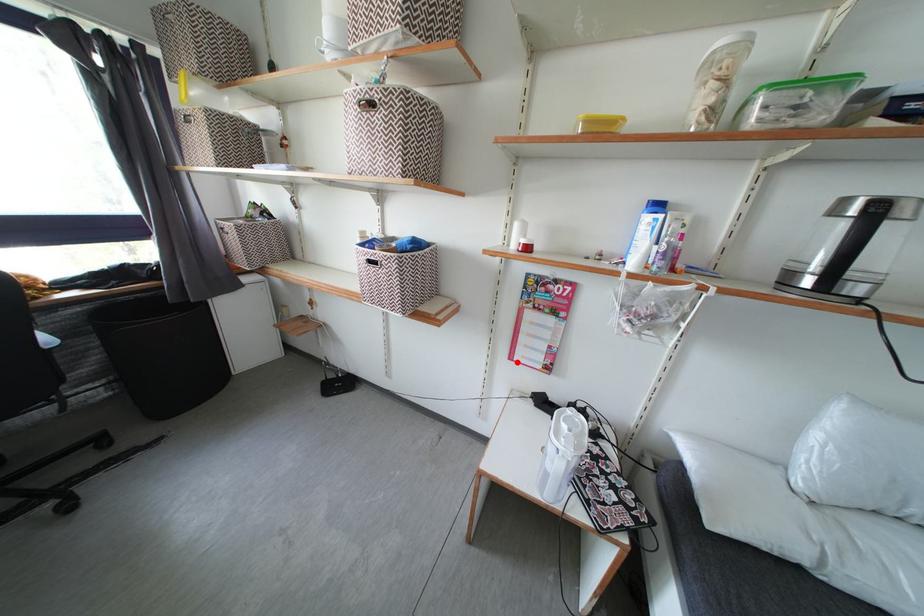
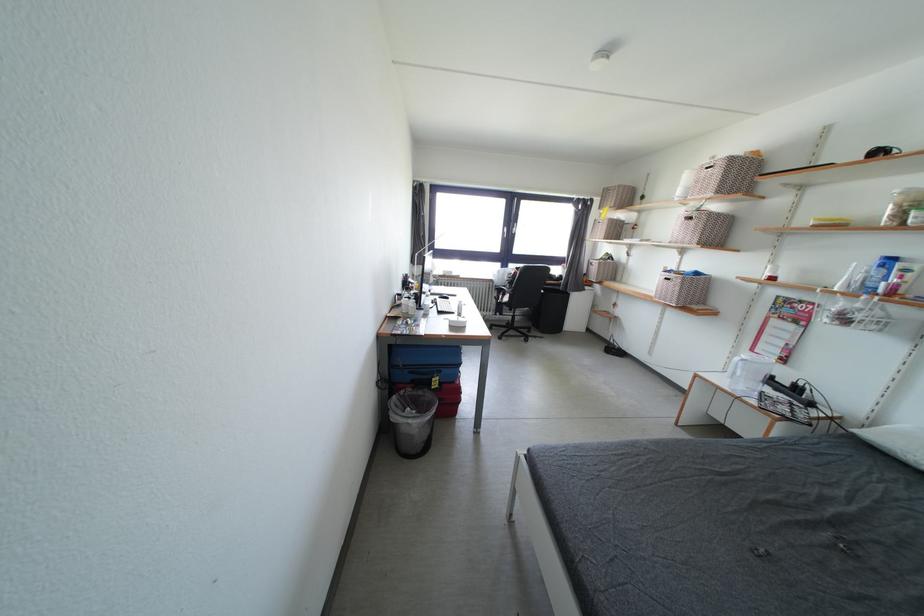
The point at the highlighted location is marked in the first image. Where is the corresponding point in the second image?

(759, 355)